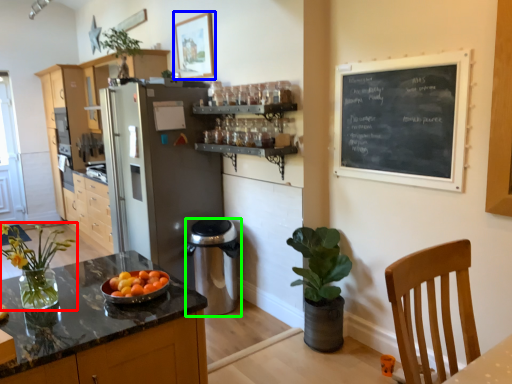
Question: Which object is positioned closest to houseplant (highlighted by a red box)? Select from picture frame (highlighted by a blue box) and appliance (highlighted by a green box).

Choices:
 (A) picture frame
 (B) appliance

Answer: (B)